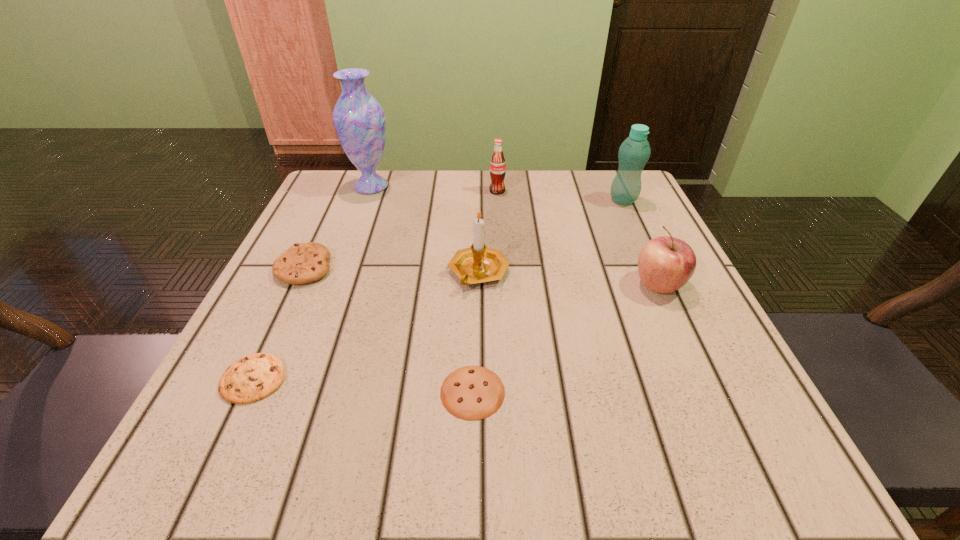
This screenshot has height=540, width=960. Find the location of `soda present at the far edge`. soda present at the far edge is located at coordinates (497, 165).

Locate an element on the screen. The height and width of the screenshot is (540, 960). object situated at the near edge is located at coordinates (472, 392).

The height and width of the screenshot is (540, 960). Identify the location of vase positioned at the left edge. (359, 120).

Find the location of a particular element. This screenshot has height=540, width=960. water bottle situated at the right edge is located at coordinates (634, 152).

At what (x,y) coordinates should I click in order to perform the action: click on apple present at the right edge. Please return your answer as a coordinate pair (x, y). The width and height of the screenshot is (960, 540). Looking at the image, I should click on (665, 264).

This screenshot has height=540, width=960. In order to click on object situated at the far left corner in this screenshot , I will do `click(359, 120)`.

Locate an element on the screen. object located at the far right corner is located at coordinates (634, 152).

The image size is (960, 540). I want to click on vacant space at the far edge, so click(x=458, y=171).

Locate an element on the screen. The image size is (960, 540). blank space at the left edge of the desktop is located at coordinates (247, 354).

The height and width of the screenshot is (540, 960). In order to click on free space at the right edge of the desktop in this screenshot , I will do [x=635, y=255].